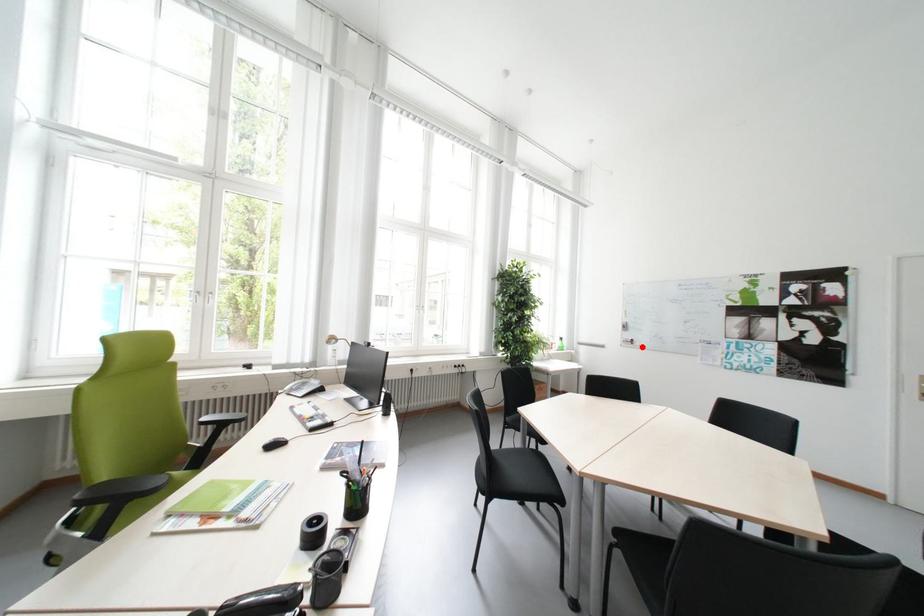
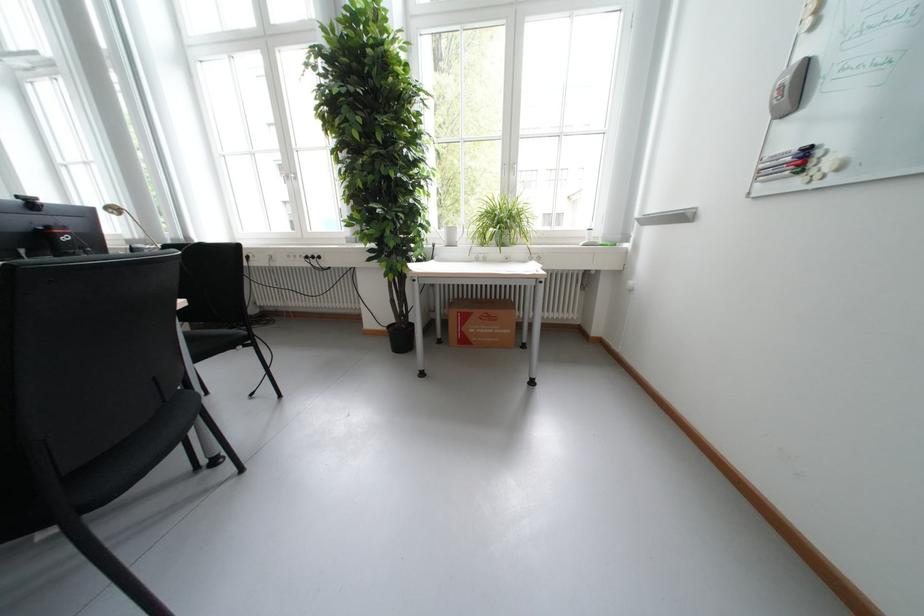
Where in the second image is the point corresponding to the highlighted location from the first image?

(806, 184)